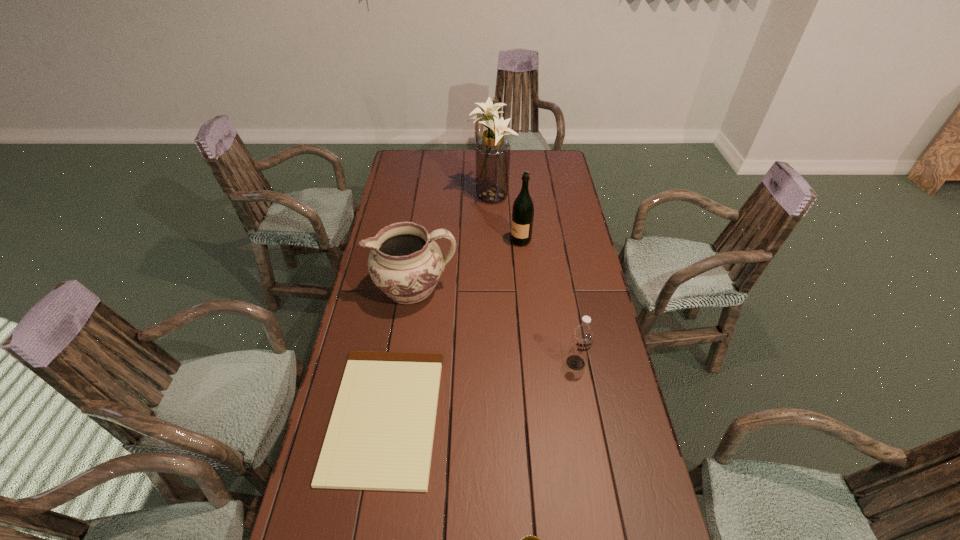
This screenshot has width=960, height=540. I want to click on free space at the right edge of the desktop, so click(x=551, y=221).

The image size is (960, 540). In order to click on vacant space at the far left corner in this screenshot , I will do [x=397, y=169].

Where is `vacant area that lies between the second farthest object and the clipboard`? Image resolution: width=960 pixels, height=540 pixels. vacant area that lies between the second farthest object and the clipboard is located at coordinates (453, 328).

Where is `free space between the third tallest object and the shortest object`? free space between the third tallest object and the shortest object is located at coordinates (399, 352).

Locate an element on the screen. This screenshot has height=540, width=960. unoccupied position between the fifth shortest object and the vodka is located at coordinates (548, 302).

The height and width of the screenshot is (540, 960). I want to click on vacant point located between the rightmost object and the flower arrangement, so click(x=533, y=280).

Locate an element on the screen. vacant point located between the vodka and the shortest object is located at coordinates 480,389.

Identify which object is the third closest to the farthest object. Please provide its 2D coordinates. Your answer should be formatted as a tuple, i.e. [(x, y)], where the tuple contains the x and y coordinates of a point satisfying the conditions above.

[(380, 437)]

Where is `the closest object relative to the flower arrangement`? This screenshot has height=540, width=960. the closest object relative to the flower arrangement is located at coordinates (523, 210).

This screenshot has width=960, height=540. In order to click on free space that satisfies the following two spatial constraints: 1. on the front-facing side of the liquor; 2. on the front side of the shortest object in this screenshot , I will do `click(539, 415)`.